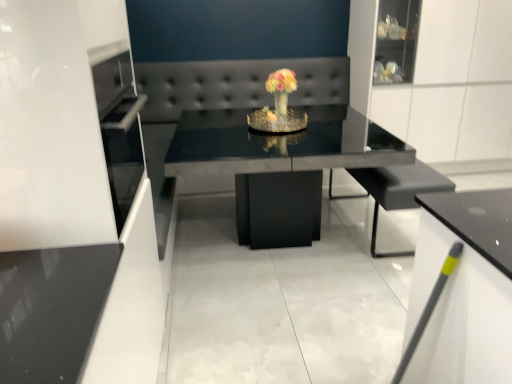
Question: From their relative heights in the image, would you say black matte armchair at center is taller or shorter than glossy black table at center?

Choices:
 (A) tall
 (B) short

Answer: (B)

Question: Relative to glossy black table at center, is black matte armchair at center in front or behind?

Choices:
 (A) front
 (B) behind

Answer: (B)

Question: Which object is positioned farthest from the pastel yellow fabric flower at center?

Choices:
 (A) glossy black table at center
 (B) white glossy cabinet at lower right
 (C) black leather couch at center
 (D) black matte armchair at center

Answer: (B)

Question: Considering the real-world distances, which object is farthest from the white glossy cabinet at lower right?

Choices:
 (A) black leather couch at center
 (B) glossy black table at center
 (C) pastel yellow fabric flower at center
 (D) black matte armchair at center

Answer: (A)